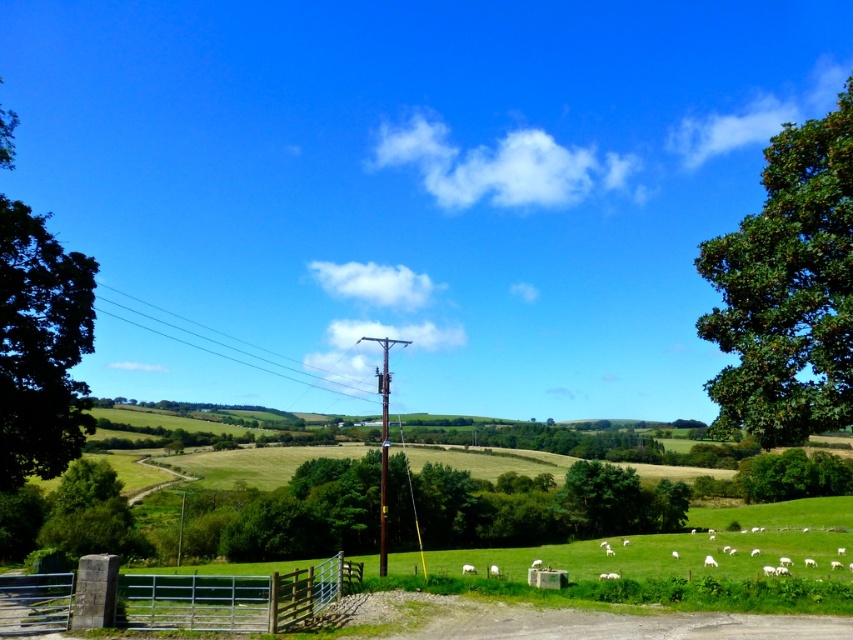
Looking at this image, between green leafy tree at left and metallic silver gate at lower center, which one is positioned lower?

metallic silver gate at lower center

Is green leafy tree at left smaller than metallic silver gate at lower center?

Correct, green leafy tree at left occupies less space than metallic silver gate at lower center.

Between point (22, 467) and point (207, 586), which one is positioned in front?

Positioned in front is point (207, 586).

Locate an element on the screen. This screenshot has height=640, width=853. green leafy tree at left is located at coordinates (39, 348).

Between green leafy tree at right and green leafy tree at lower right, which one has more height?

With more height is green leafy tree at right.

Is green leafy tree at right further to camera compared to green leafy tree at lower right?

No, green leafy tree at right is in front of green leafy tree at lower right.

Where is `green leafy tree at right`? This screenshot has height=640, width=853. green leafy tree at right is located at coordinates (787, 289).

This screenshot has width=853, height=640. What do you see at coordinates (787, 289) in the screenshot?
I see `green leafy tree at right` at bounding box center [787, 289].

I want to click on green leafy tree at right, so click(787, 289).